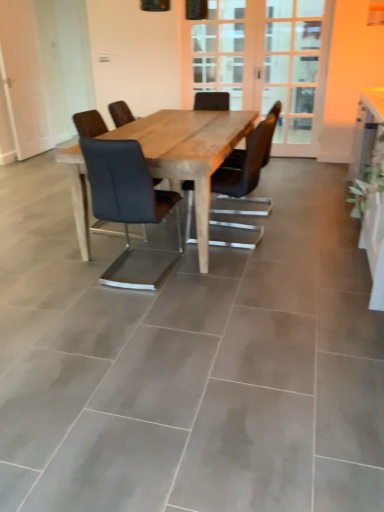
Image resolution: width=384 pixels, height=512 pixels. What are the coordinates of `matte black chair at center, the first chair viewed from the left` in the screenshot? It's located at (129, 209).

In order to face wooden screen door at center, which ranks as the 1th screen door in left-to-right order, should I rotate leftwards or rightwards?

Rotate right and turn 8.239 degrees.

This screenshot has height=512, width=384. What do you see at coordinates (245, 164) in the screenshot?
I see `matte black chair at center, the second chair viewed from the left` at bounding box center [245, 164].

Locate an element on the screen. The width and height of the screenshot is (384, 512). clear glass door at upper center, the second screen door viewed from the left is located at coordinates (296, 70).

Locate an element on the screen. The image size is (384, 512). matte black chair at center, the first chair viewed from the left is located at coordinates (129, 209).

Considering the relative positions of white glossy computer desk at right and green leafy plant at upper right in the image provided, is white glossy computer desk at right to the left of green leafy plant at upper right from the viewer's perspective?

Yes, white glossy computer desk at right is to the left of green leafy plant at upper right.

Is white glossy computer desk at right aimed at green leafy plant at upper right?

No, white glossy computer desk at right is not facing towards green leafy plant at upper right.

Is white glossy computer desk at right next to green leafy plant at upper right and touching it?

Yes, white glossy computer desk at right is next to green leafy plant at upper right.

Is matte black chair at center, the first chair viewed from the left, surrounding natural wood table at center?

No.

Which is in front, point (101, 155) or point (205, 237)?

The point (101, 155) is closer to the camera.

Are matte black chair at center, the first chair viewed from the left, and natural wood table at center located far from each other?

matte black chair at center, the first chair viewed from the left, is actually quite close to natural wood table at center.

Is matte black chair at center, the first chair viewed from the left, taller or shorter than natural wood table at center?

Clearly, matte black chair at center, the first chair viewed from the left, is taller compared to natural wood table at center.

Could you tell me if matte black chair at center, the second chair in the right-to-left sequence, is turned towards clear glass door at upper center, the second screen door viewed from the left?

Yes, matte black chair at center, the second chair in the right-to-left sequence, is turned towards clear glass door at upper center, the second screen door viewed from the left.

Considering the sizes of matte black chair at center, the second chair in the right-to-left sequence, and clear glass door at upper center, the first screen door from the right, in the image, is matte black chair at center, the second chair in the right-to-left sequence, taller or shorter than clear glass door at upper center, the first screen door from the right,?

Clearly, matte black chair at center, the second chair in the right-to-left sequence, is shorter compared to clear glass door at upper center, the first screen door from the right.

Between matte black chair at center, the first chair viewed from the left, and clear glass door at upper center, the second screen door viewed from the left, which one appears on the right side from the viewer's perspective?

From the viewer's perspective, clear glass door at upper center, the second screen door viewed from the left, appears more on the right side.

Is matte black chair at center, the second chair in the right-to-left sequence, inside or outside of clear glass door at upper center, the first screen door from the right?

The correct answer is: outside.

Is matte black chair at center, the first chair viewed from the left, not close to white glossy computer desk at right?

Yes, matte black chair at center, the first chair viewed from the left, is far from white glossy computer desk at right.

Does matte black chair at center, the first chair viewed from the left, have a lesser height compared to white glossy computer desk at right?

Yes.

Is point (110, 220) positioned before point (377, 164)?

No, (110, 220) is further to viewer.

From the image's perspective, is green leafy plant at upper right located above natural wood table at center?

Yes, from the image's perspective, green leafy plant at upper right is above natural wood table at center.

From a real-world perspective, which object rests below the other?

In real-world perspective, natural wood table at center is lower.

Looking at this image, between green leafy plant at upper right and natural wood table at center, which one is positioned behind?

Positioned behind is green leafy plant at upper right.

Is green leafy plant at upper right surrounding natural wood table at center?

No, green leafy plant at upper right does not contain natural wood table at center.

Does wooden screen door at center, the second screen door positioned from the right, have a lesser height compared to matte black chair at center, the second chair in the right-to-left sequence?

No, wooden screen door at center, the second screen door positioned from the right, is not shorter than matte black chair at center, the second chair in the right-to-left sequence.

What's the angular difference between wooden screen door at center, the second screen door positioned from the right, and matte black chair at center, the second chair in the right-to-left sequence,'s facing directions?

The angle between the facing direction of wooden screen door at center, the second screen door positioned from the right, and the facing direction of matte black chair at center, the second chair in the right-to-left sequence, is 179 degrees.

Could you tell me if wooden screen door at center, which ranks as the 1th screen door in left-to-right order, is facing matte black chair at center, the second chair in the right-to-left sequence?

Yes, wooden screen door at center, which ranks as the 1th screen door in left-to-right order, is oriented towards matte black chair at center, the second chair in the right-to-left sequence.

From the image's perspective, which one is positioned lower, wooden screen door at center, the second screen door positioned from the right, or matte black chair at center, the second chair in the right-to-left sequence?

matte black chair at center, the second chair in the right-to-left sequence, appears lower in the image.

Would you say clear glass door at upper center, the first screen door from the right, is inside or outside wooden screen door at center, the second screen door positioned from the right?

The correct answer is: inside.

How many degrees apart are the facing directions of clear glass door at upper center, the second screen door viewed from the left, and wooden screen door at center, the second screen door positioned from the right?

There is a 0.00184-degree angle between the facing directions of clear glass door at upper center, the second screen door viewed from the left, and wooden screen door at center, the second screen door positioned from the right.

Is clear glass door at upper center, the second screen door viewed from the left, wider than wooden screen door at center, the second screen door positioned from the right?

No, clear glass door at upper center, the second screen door viewed from the left, is not wider than wooden screen door at center, the second screen door positioned from the right.

Is clear glass door at upper center, the second screen door viewed from the left, to the right of wooden screen door at center, the second screen door positioned from the right, from the viewer's perspective?

Yes, clear glass door at upper center, the second screen door viewed from the left, is to the right of wooden screen door at center, the second screen door positioned from the right.

Image resolution: width=384 pixels, height=512 pixels. In order to click on computer desk that appears on the left of green leafy plant at upper right in this screenshot , I will do `click(372, 197)`.

The image size is (384, 512). Identify the location of kitchen & dining room table above the matte black chair at center, the first chair viewed from the left (from the image's perspective). (189, 152).

Estimate the real-world distances between objects in this image. Which object is closer to natural wood table at center, green leafy plant at upper right or matte black chair at center, the first chair viewed from the left?

Based on the image, matte black chair at center, the first chair viewed from the left, appears to be nearer to natural wood table at center.

Considering their positions, is natural wood table at center positioned further to matte black chair at center, the second chair in the right-to-left sequence, than wooden screen door at center, the second screen door positioned from the right?

wooden screen door at center, the second screen door positioned from the right, lies further to matte black chair at center, the second chair in the right-to-left sequence, than the other object.

Based on their spatial positions, is matte black chair at center, the 1th chair positioned from the right, or wooden screen door at center, which ranks as the 1th screen door in left-to-right order, closer to clear glass door at upper center, the second screen door viewed from the left?

wooden screen door at center, which ranks as the 1th screen door in left-to-right order, is positioned closer to the anchor clear glass door at upper center, the second screen door viewed from the left.

Estimate the real-world distances between objects in this image. Which object is further from clear glass door at upper center, the first screen door from the right, matte black chair at center, the second chair viewed from the left, or natural wood table at center?

Among the two, matte black chair at center, the second chair viewed from the left, is located further to clear glass door at upper center, the first screen door from the right.

Looking at the image, which one is located closer to natural wood table at center, white glossy computer desk at right or clear glass door at upper center, the first screen door from the right?

Based on the image, white glossy computer desk at right appears to be nearer to natural wood table at center.

Which object lies nearer to the anchor point white glossy computer desk at right, matte black chair at center, the first chair viewed from the left, or clear glass door at upper center, the second screen door viewed from the left?

Among the two, matte black chair at center, the first chair viewed from the left, is located nearer to white glossy computer desk at right.

Based on their spatial positions, is wooden screen door at center, which ranks as the 1th screen door in left-to-right order, or clear glass door at upper center, the first screen door from the right, further from matte black chair at center, the second chair viewed from the left?

wooden screen door at center, which ranks as the 1th screen door in left-to-right order, lies further to matte black chair at center, the second chair viewed from the left, than the other object.

Which object lies nearer to the anchor point natural wood table at center, wooden screen door at center, the second screen door positioned from the right, or clear glass door at upper center, the second screen door viewed from the left?

clear glass door at upper center, the second screen door viewed from the left, is positioned closer to the anchor natural wood table at center.

Where is `plant between matte black chair at center, the second chair in the right-to-left sequence, and clear glass door at upper center, the first screen door from the right, from front to back`? This screenshot has height=512, width=384. plant between matte black chair at center, the second chair in the right-to-left sequence, and clear glass door at upper center, the first screen door from the right, from front to back is located at coordinates (369, 180).

Find the location of a particular element. Image resolution: width=384 pixels, height=512 pixels. kitchen & dining room table located between matte black chair at center, the first chair viewed from the left, and white glossy computer desk at right in the left-right direction is located at coordinates (189, 152).

Where is `chair between natural wood table at center and clear glass door at upper center, the first screen door from the right, in the front-back direction`? chair between natural wood table at center and clear glass door at upper center, the first screen door from the right, in the front-back direction is located at coordinates [x=245, y=164].

This screenshot has width=384, height=512. I want to click on kitchen & dining room table located between matte black chair at center, the second chair in the right-to-left sequence, and green leafy plant at upper right in the left-right direction, so click(189, 152).